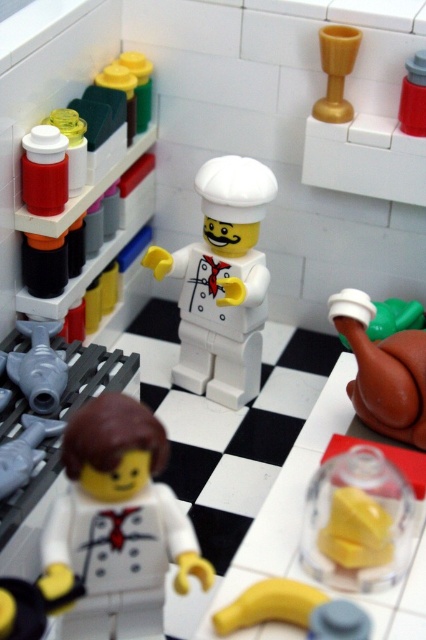
You are holding a LEGO brick that is 3 inches long and want to place it on the floor directly in front of you. The floor is at point (89, 429). Can you place the brick there without it extending beyond the floor?

The distance between you and point (89, 429) is 29.34 inches. Since the brick is only 3 inches long, placing it there would leave plenty of space between you and the brick, so it should fit without extending beyond the floor.

You are a LEGO figure trying to reach the smooth plastic bottle at upper right from where the smooth white chef at center is standing. Based on their positions, can you tell if the bottle is above or below the chef?

The smooth plastic bottle at upper right is located above the smooth white chef at center, so the bottle is above the chef.